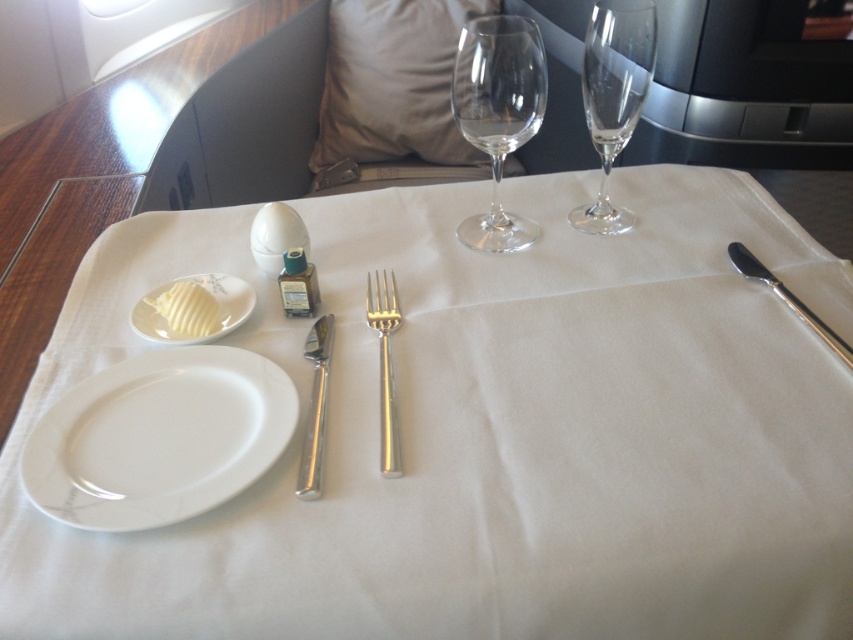
In the scene shown: You are a flight attendant on a private jet. You need to place a small bottle of olive oil between the white porcelain plate at center and the white porcelain plate at upper left. The bottle is 3 inches long. Can you fit it in the space between them without moving the plates?

The distance between the white porcelain plate at center and white porcelain plate at upper left is 10.15 inches. Since the bottle is only 3 inches long, there is enough space to place it between them without moving the plates.

You are a flight attendant on a private jet. You need to place a 12 inch long silverware set on the table. The white porcelain plate at lower left is already there. Can you place the silverware set on the table without moving the plate?

The white porcelain plate at lower left is 15.49 inches from the camera. Since the silverware set is 12 inches long, there is enough space between the plate and the edge of the table to place it without moving the plate.